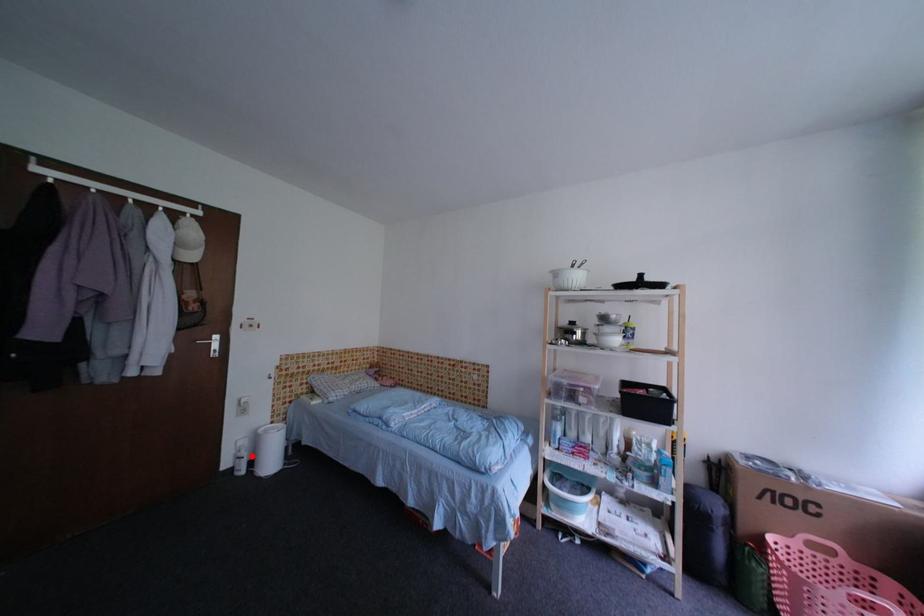
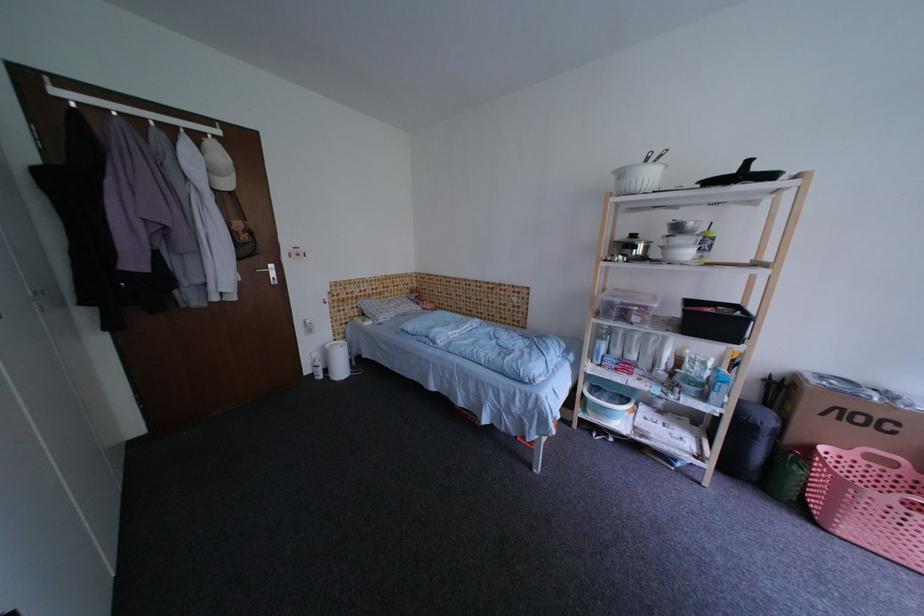
Question: I am providing you with two images of the same scene from different viewpoints. In image1, a red point is highlighted. Considering the same 3D point in image2, which of the following is correct?

Choices:
 (A) It is closer
 (B) It is farther

Answer: (A)